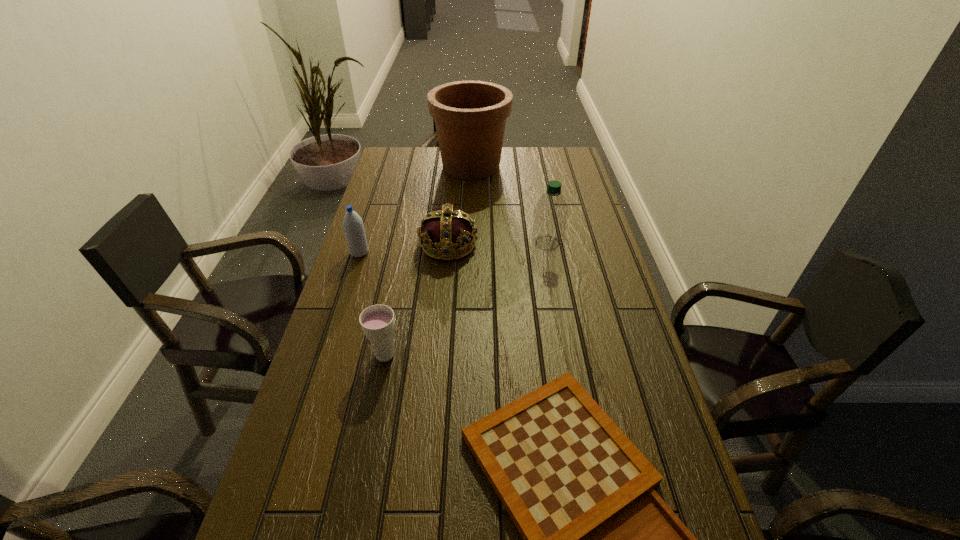
Locate an element on the screen. free space between the right water bottle and the crown is located at coordinates (498, 244).

Locate an element on the screen. vacant space that is in between the flowerpot and the shorter water bottle is located at coordinates (416, 210).

Identify the location of empty space between the farthest object and the cup. The height and width of the screenshot is (540, 960). (428, 260).

The image size is (960, 540). In order to click on free spot between the second nearest object and the crown in this screenshot , I will do `click(417, 300)`.

Find the location of a particular element. This screenshot has width=960, height=540. free space that is in between the taller water bottle and the crown is located at coordinates (498, 244).

The height and width of the screenshot is (540, 960). What are the coordinates of `empty space between the fifth shortest object and the tallest object` in the screenshot? It's located at (510, 205).

The height and width of the screenshot is (540, 960). What are the coordinates of `empty space that is in between the left water bottle and the crown` in the screenshot? It's located at (404, 249).

I want to click on free space between the crown and the taller water bottle, so click(x=498, y=244).

At what (x,y) coordinates should I click in order to perform the action: click on object that is the fourth closest one to the crown. Please return your answer as a coordinate pair (x, y). The image size is (960, 540). Looking at the image, I should click on (x=377, y=321).

Locate which object ranks in proximity to the left water bottle. Please provide its 2D coordinates. Your answer should be formatted as a tuple, i.e. [(x, y)], where the tuple contains the x and y coordinates of a point satisfying the conditions above.

[(445, 229)]